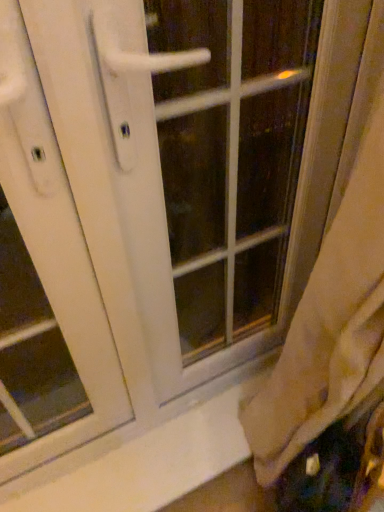
Question: Does white glossy door handle at center have a smaller size compared to white smooth window sill at lower center?

Choices:
 (A) no
 (B) yes

Answer: (A)

Question: Can you confirm if white glossy door handle at center is positioned to the left of white smooth window sill at lower center?

Choices:
 (A) yes
 (B) no

Answer: (B)

Question: Is white glossy door handle at center located outside white smooth window sill at lower center?

Choices:
 (A) no
 (B) yes

Answer: (B)

Question: From the image's perspective, is white glossy door handle at center below white smooth window sill at lower center?

Choices:
 (A) no
 (B) yes

Answer: (A)

Question: Considering the relative sizes of white glossy door handle at center and white smooth window sill at lower center in the image provided, is white glossy door handle at center bigger than white smooth window sill at lower center?

Choices:
 (A) no
 (B) yes

Answer: (B)

Question: Is white smooth window sill at lower center at the back of white glossy door handle at center?

Choices:
 (A) yes
 (B) no

Answer: (B)

Question: Would you say white plastic screen door at left is a long distance from white glossy door handle at center?

Choices:
 (A) yes
 (B) no

Answer: (B)

Question: Does white plastic screen door at left contain white glossy door handle at center?

Choices:
 (A) no
 (B) yes

Answer: (A)

Question: From the image's perspective, would you say white plastic screen door at left is positioned over white glossy door handle at center?

Choices:
 (A) yes
 (B) no

Answer: (B)

Question: Would you say white plastic screen door at left is outside white glossy door handle at center?

Choices:
 (A) no
 (B) yes

Answer: (B)

Question: Does white plastic screen door at left have a greater height compared to white glossy door handle at center?

Choices:
 (A) yes
 (B) no

Answer: (A)

Question: Is white plastic screen door at left aimed at white glossy door handle at center?

Choices:
 (A) no
 (B) yes

Answer: (A)

Question: Is white smooth window sill at lower center looking in the opposite direction of white plastic screen door at left?

Choices:
 (A) no
 (B) yes

Answer: (A)